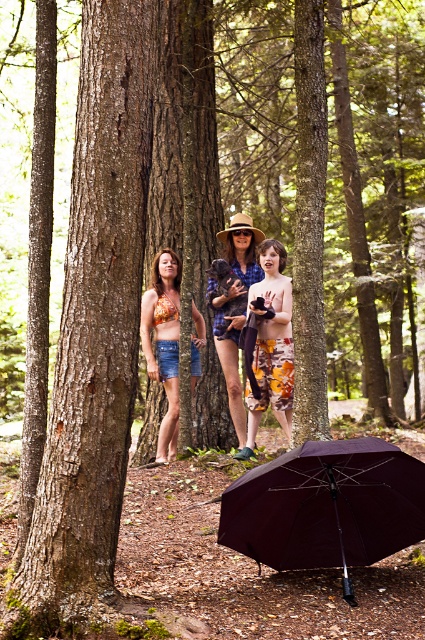
You are a photographer trying to capture a group photo of the two women and the dog in the forest scene. The burgundy fabric umbrella at lower center and the floral fabric bikini top at center are part of the subjects. Given their distance apart, can you estimate whether you can fit both into a single frame without zooming in? Assume your camera has a standard 50mm lens and you are positioned 5 meters away from the subjects.

The distance between the burgundy fabric umbrella at lower center and the floral fabric bikini top at center is 3.75 meters. With a standard 50mm lens at 5 meters, the horizontal field of view is approximately 4 meters. Since 3.75 meters is within this range, both objects can fit into a single frame without zooming in.

You are standing in the forest and want to reach the burgundy fabric umbrella at lower center without stepping on the scattered leaves. Which direction should you move from your current position at point (326,506)?

The point (326,506) is already the location of the burgundy fabric umbrella at lower center, so you are already at the desired location.